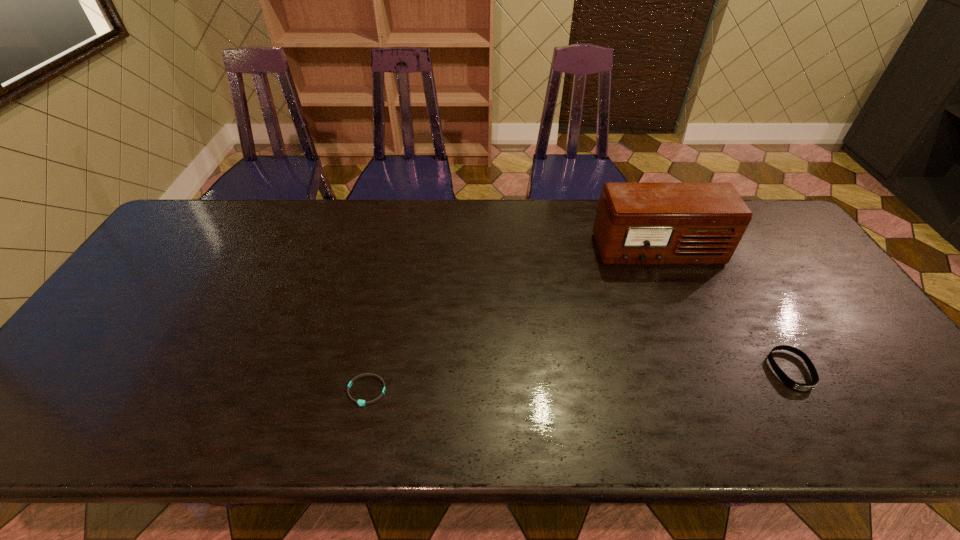
At what (x,y) coordinates should I click in order to perform the action: click on vacant space that is in between the tallest object and the leftmost object. Please return your answer as a coordinate pair (x, y). Looking at the image, I should click on (513, 321).

This screenshot has height=540, width=960. Identify the location of free space between the farthest object and the left wristband. (513, 321).

Find the location of `vacant area that lies between the leftmost object and the right wristband`. vacant area that lies between the leftmost object and the right wristband is located at coordinates (579, 381).

You are a GUI agent. You are given a task and a screenshot of the screen. Output one action in this format:
    pyautogui.click(x=<x>, y=<y>)
    Task: Click on the unoccupied area between the farthest object and the left wristband
    The height and width of the screenshot is (540, 960).
    Given the screenshot: What is the action you would take?
    click(x=513, y=321)

Image resolution: width=960 pixels, height=540 pixels. I want to click on vacant area between the tallest object and the taller wristband, so coord(725,311).

Image resolution: width=960 pixels, height=540 pixels. What are the coordinates of `object that stands as the second closest to the taller wristband` in the screenshot? It's located at (360, 402).

I want to click on object that ranks as the second closest to the taller wristband, so click(x=360, y=402).